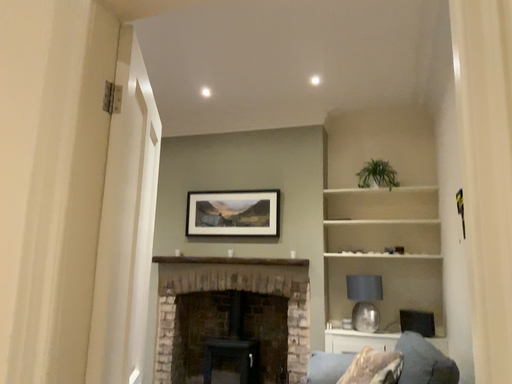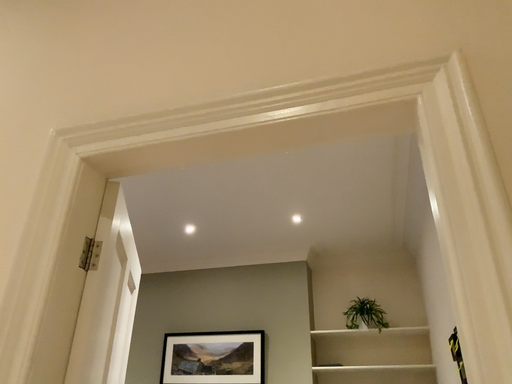
Question: Which way did the camera rotate in the video?

Choices:
 (A) rotated downward
 (B) rotated upward

Answer: (B)